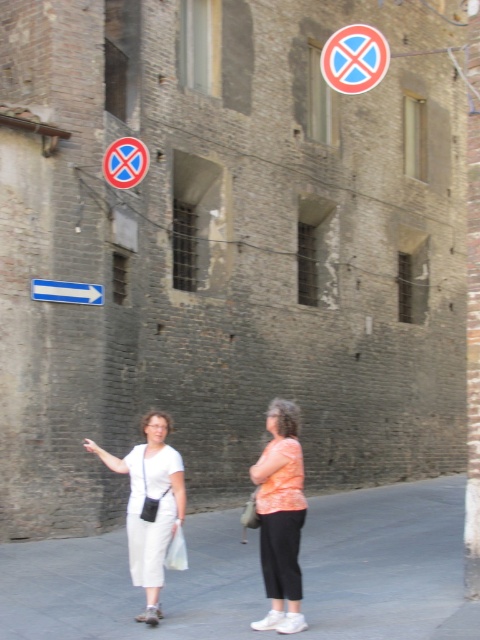
Between point (136, 582) and point (120, 179), which one is positioned behind?

Positioned behind is point (120, 179).

Find the location of `white cotton pants at lower left`. white cotton pants at lower left is located at coordinates (149, 504).

Who is higher up, gray concrete pavement at center or blue circular sign at upper left?

blue circular sign at upper left is above.

You are a GUI agent. You are given a task and a screenshot of the screen. Output one action in this format:
    pyautogui.click(x=<x>, y=<y>)
    Task: Click on the gray concrete pavement at center
    This screenshot has width=480, height=640.
    Given the screenshot: What is the action you would take?
    pyautogui.click(x=260, y=576)

Where is `gray concrete pavement at center`? The image size is (480, 640). gray concrete pavement at center is located at coordinates tap(260, 576).

Does blue circular sign with red x at upper center appear on the right side of blue plastic arrow at left?

Yes, blue circular sign with red x at upper center is to the right of blue plastic arrow at left.

Does blue circular sign with red x at upper center come in front of blue plastic arrow at left?

Yes, it is.

From the picture: Who is more forward, (360,67) or (61,289)?

Positioned in front is point (360,67).

You are a GUI agent. You are given a task and a screenshot of the screen. Output one action in this format:
    pyautogui.click(x=<x>, y=<y>)
    Task: Click on the blue circular sign with red x at upper center
    This screenshot has height=640, width=480.
    Given the screenshot: What is the action you would take?
    pyautogui.click(x=355, y=58)